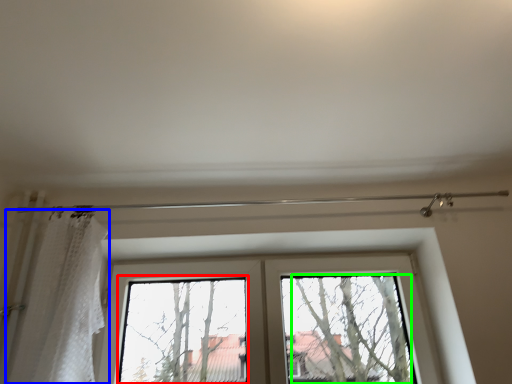
Question: Which is nearer to the bay window (highlighted by a red box)? shower curtain (highlighted by a blue box) or tree (highlighted by a green box).

Choices:
 (A) shower curtain
 (B) tree

Answer: (A)